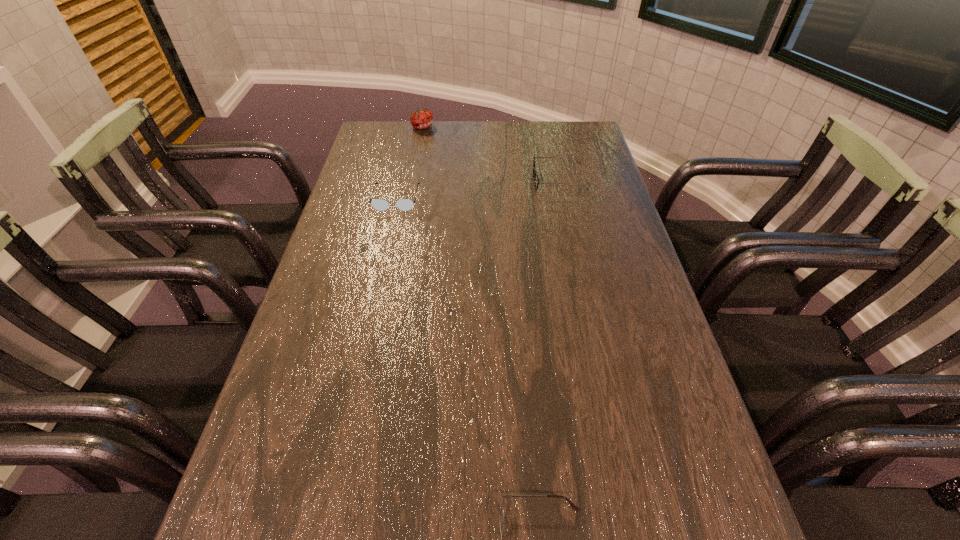
Find the location of `vacant region between the rightmost object and the tomato`. vacant region between the rightmost object and the tomato is located at coordinates (491, 154).

The height and width of the screenshot is (540, 960). What are the coordinates of `empty space between the leftmost spectacles and the tallest object` in the screenshot? It's located at (410, 163).

The image size is (960, 540). Identify the location of object that stands as the third closest to the farthest object. (572, 505).

Select which object appears as the second closest to the rightmost spectacles. Please provide its 2D coordinates. Your answer should be formatted as a tuple, i.e. [(x, y)], where the tuple contains the x and y coordinates of a point satisfying the conditions above.

[(422, 118)]

Locate an element on the screen. This screenshot has height=540, width=960. spectacles that stands as the third closest to the tallest object is located at coordinates (572, 505).

Select which spectacles appears as the second closest to the second tallest spectacles. Please provide its 2D coordinates. Your answer should be formatted as a tuple, i.e. [(x, y)], where the tuple contains the x and y coordinates of a point satisfying the conditions above.

[(572, 505)]

You are a GUI agent. You are given a task and a screenshot of the screen. Output one action in this format:
    pyautogui.click(x=<x>, y=<y>)
    Task: Click on the vacant space that satisfies the following two spatial constraints: 1. through the lenses of the rightmost object; 2. on the lenses of the second shortest spectacles
    This screenshot has width=960, height=540.
    Given the screenshot: What is the action you would take?
    563,199

Identify the location of free space in the image that satisfies the following two spatial constraints: 1. through the lenses of the rightmost object; 2. on the lenses of the second tallest spectacles. The width and height of the screenshot is (960, 540). (563, 199).